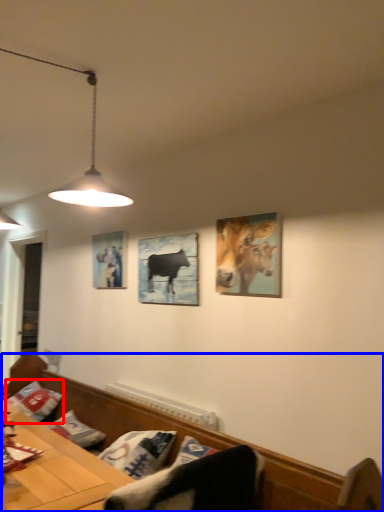
Question: Among these objects, which one is nearest to the camera, pillow (highlighted by a red box) or furniture (highlighted by a blue box)?

Choices:
 (A) pillow
 (B) furniture

Answer: (B)